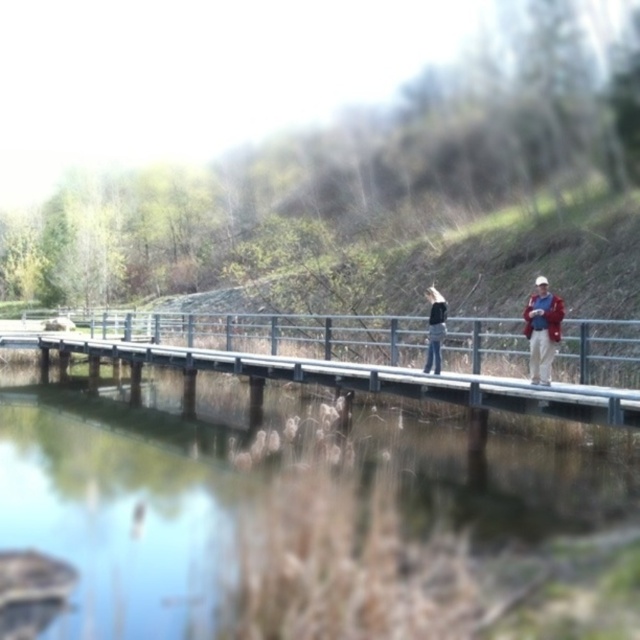
Question: Estimate the real-world distances between objects in this image. Which object is farther from the clear water at bridge center?

Choices:
 (A) metallic gray bridge at center
 (B) matte black shirt at center
 (C) red jacket at right
 (D) dark blue jeans at center

Answer: (C)

Question: In this image, where is matte black shirt at center located relative to red jacket at right?

Choices:
 (A) left
 (B) right

Answer: (B)

Question: Which point is closer to the camera?

Choices:
 (A) clear water at bridge center
 (B) metallic gray bridge at center

Answer: (A)

Question: Which point is closer to the camera?

Choices:
 (A) dark blue jeans at center
 (B) red jacket at right
 (C) metallic gray bridge at center

Answer: (C)

Question: Is matte black shirt at center to the right of dark blue jeans at center from the viewer's perspective?

Choices:
 (A) yes
 (B) no

Answer: (A)

Question: Does metallic gray bridge at center have a lesser width compared to matte black shirt at center?

Choices:
 (A) yes
 (B) no

Answer: (B)